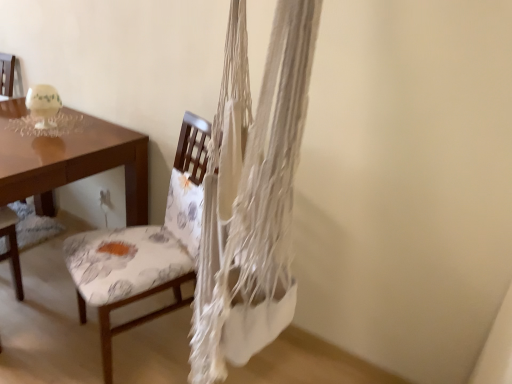
Question: Is floral fabric chair at left oriented away from brown glossy desk at left?

Choices:
 (A) yes
 (B) no

Answer: (B)

Question: Is floral fabric chair at left thinner than brown glossy desk at left?

Choices:
 (A) yes
 (B) no

Answer: (A)

Question: Is floral fabric chair at left far away from brown glossy desk at left?

Choices:
 (A) yes
 (B) no

Answer: (B)

Question: Could brown glossy desk at left be considered to be inside floral fabric chair at left?

Choices:
 (A) yes
 (B) no

Answer: (B)

Question: Considering the relative sizes of floral fabric chair at left and brown glossy desk at left in the image provided, is floral fabric chair at left smaller than brown glossy desk at left?

Choices:
 (A) no
 (B) yes

Answer: (B)

Question: From a real-world perspective, is floral fabric chair at left located higher than brown glossy desk at left?

Choices:
 (A) no
 (B) yes

Answer: (B)

Question: From a real-world perspective, is brown glossy desk at left below floral fabric chair at left?

Choices:
 (A) no
 (B) yes

Answer: (B)

Question: Does brown glossy desk at left have a lesser width compared to floral fabric chair at left?

Choices:
 (A) yes
 (B) no

Answer: (B)

Question: Is floral fabric chair at left inside brown glossy desk at left?

Choices:
 (A) yes
 (B) no

Answer: (B)

Question: Is brown glossy desk at left shorter than floral fabric chair at left?

Choices:
 (A) yes
 (B) no

Answer: (A)

Question: From the image's perspective, does brown glossy desk at left appear lower than floral fabric chair at left?

Choices:
 (A) yes
 (B) no

Answer: (B)

Question: Is brown glossy desk at left next to floral fabric chair at left and touching it?

Choices:
 (A) yes
 (B) no

Answer: (B)

Question: Is floral fabric chair at left in front of or behind brown glossy desk at left in the image?

Choices:
 (A) front
 (B) behind

Answer: (A)